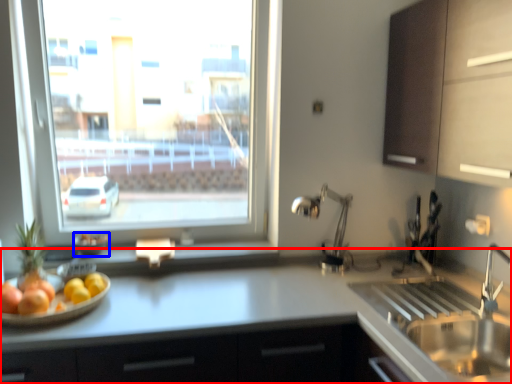
Question: Among these objects, which one is farthest to the camera, countertop (highlighted by a red box) or glass bowl (highlighted by a blue box)?

Choices:
 (A) countertop
 (B) glass bowl

Answer: (B)